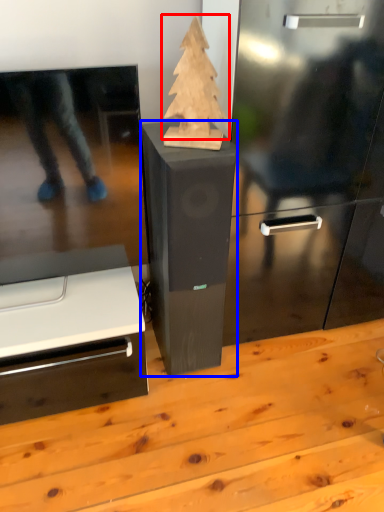
Question: Which point is further to the camera, christmas tree (highlighted by a red box) or furniture (highlighted by a blue box)?

Choices:
 (A) christmas tree
 (B) furniture

Answer: (B)